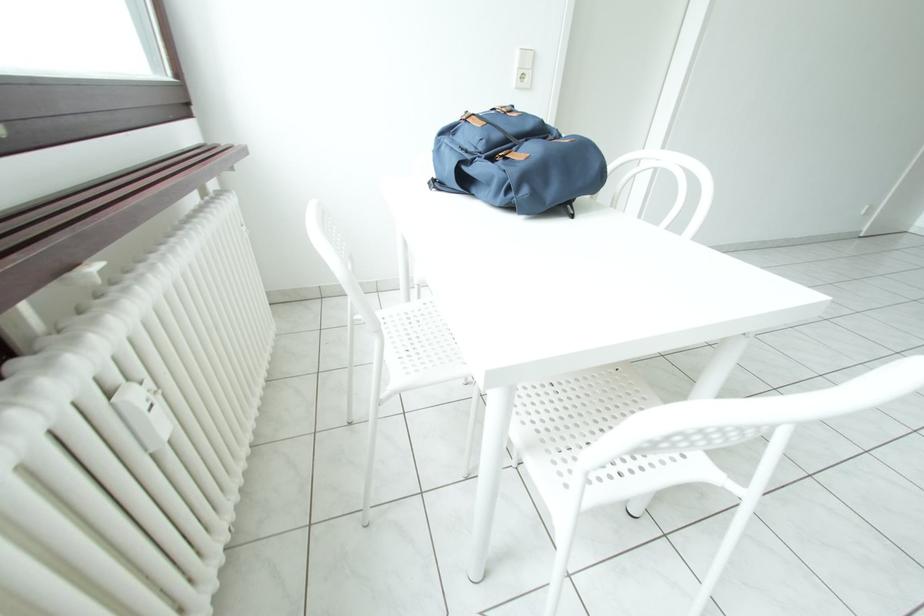
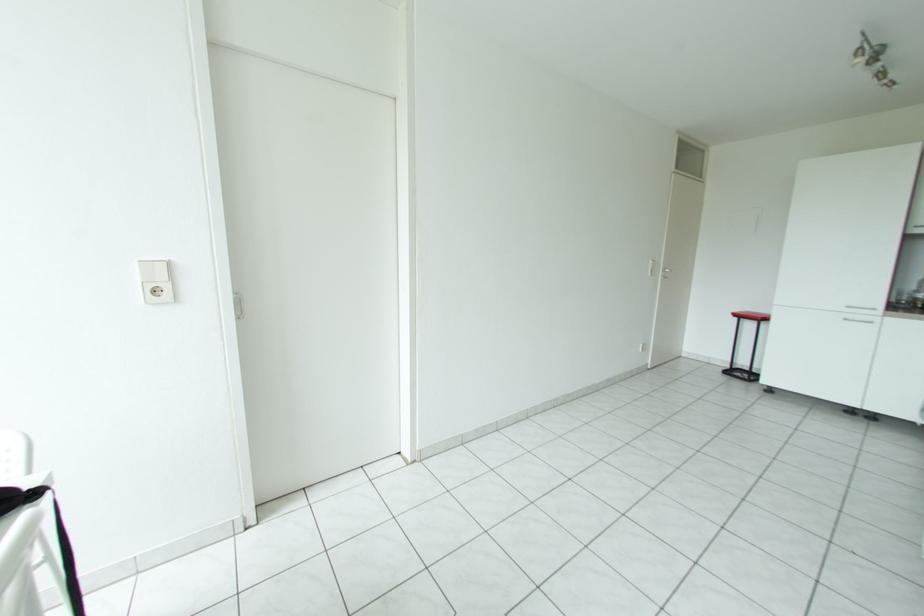
Question: What movement of the cameraman would produce the second image?

Choices:
 (A) Left
 (B) Right
 (C) Forward
 (D) Backward

Answer: (B)